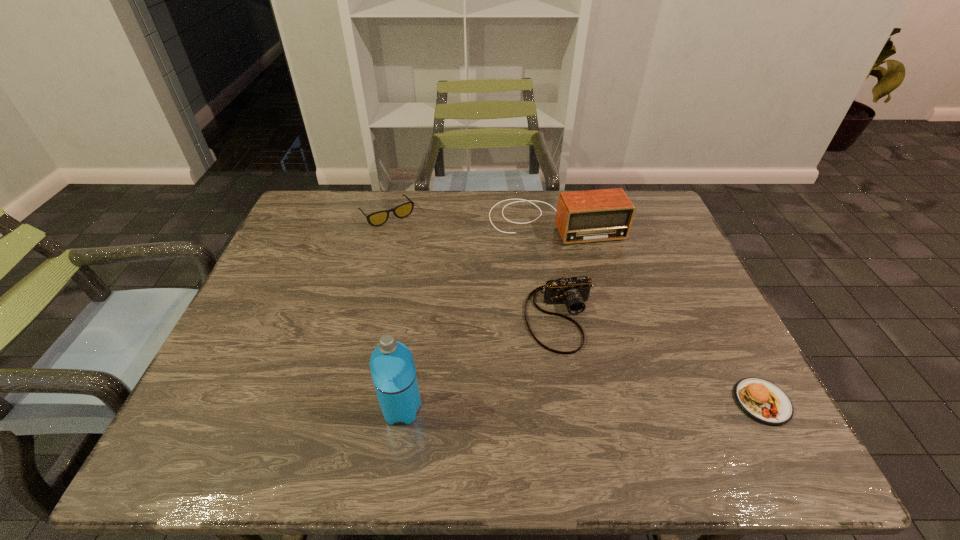
The width and height of the screenshot is (960, 540). Find the location of `object that is the fourth nearest to the patty`. object that is the fourth nearest to the patty is located at coordinates (375, 219).

Find the location of a particular element. free space that satisfies the following two spatial constraints: 1. on the front side of the sunglasses; 2. on the left side of the third nearest object is located at coordinates (360, 318).

I want to click on free location that satisfies the following two spatial constraints: 1. on the front side of the patty; 2. on the left side of the third tallest object, so click(x=576, y=402).

Locate an element on the screen. The height and width of the screenshot is (540, 960). free space in the image that satisfies the following two spatial constraints: 1. on the front side of the patty; 2. on the left side of the second tallest object is located at coordinates (592, 402).

This screenshot has width=960, height=540. What are the coordinates of `free space that satisfies the following two spatial constraints: 1. on the front side of the second tallest object; 2. on the right side of the patty` in the screenshot? It's located at (592, 402).

Find the location of a particular element. The height and width of the screenshot is (540, 960). blank space that satisfies the following two spatial constraints: 1. on the front side of the third tallest object; 2. on the left side of the rightmost object is located at coordinates (576, 402).

Find the location of `free spot that satisfies the following two spatial constraints: 1. on the back side of the thermos bottle; 2. on the right side of the rightmost object`. free spot that satisfies the following two spatial constraints: 1. on the back side of the thermos bottle; 2. on the right side of the rightmost object is located at coordinates (403, 402).